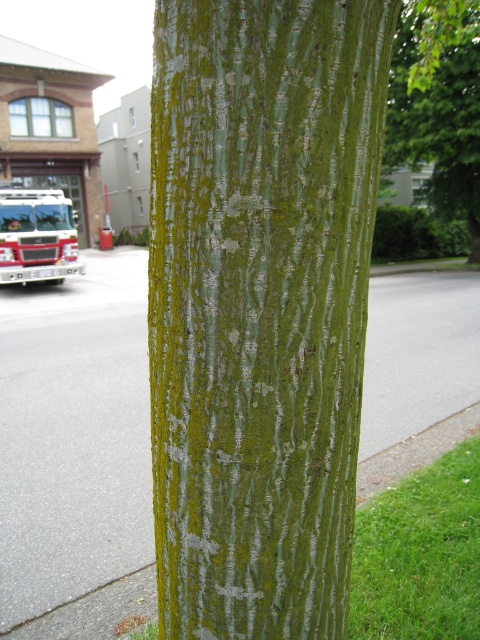
You are a delivery person trying to park your van between the gray asphalt pavement at center and the white glossy fire truck at left. Can you fit your van there if it requires 5 meters of space?

The gray asphalt pavement at center has a larger size compared to the white glossy fire truck at left, but the exact dimensions of the available space aren

You are a delivery person who needs to park your 5 meter long truck between the gray asphalt pavement at center and the white glossy fire truck at left. Can you fit your truck in that space?

The distance between the gray asphalt pavement at center and the white glossy fire truck at left is 10.54 meters. Since your truck is 5 meters long, there is enough space to park it between them.